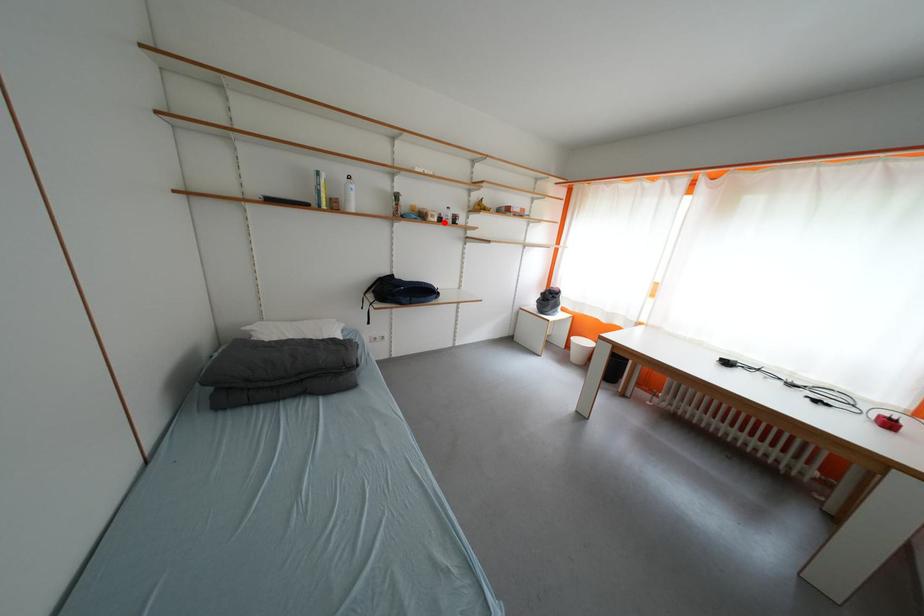
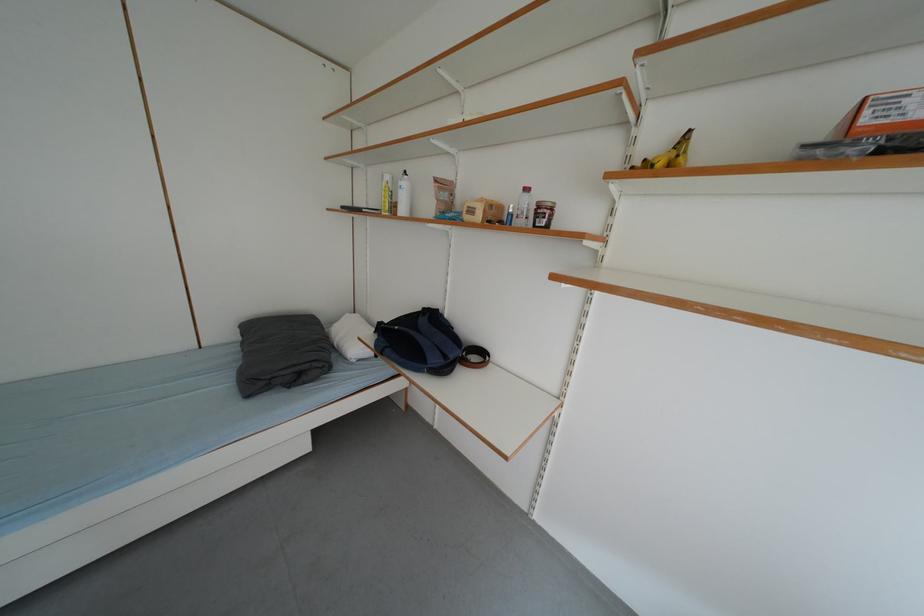
Question: I am providing you with two images of the same scene from different viewpoints. In image1, a red point is highlighted. Considering the same 3D point in image2, which of the following is correct?

Choices:
 (A) It is closer
 (B) It is farther

Answer: (B)